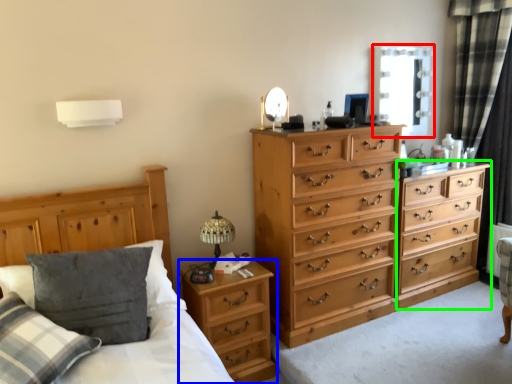
Question: Which object is the closest to the window screen (highlighted by a red box)? Choose among these: nightstand (highlighted by a blue box) or chest of drawers (highlighted by a green box).

Choices:
 (A) nightstand
 (B) chest of drawers

Answer: (B)